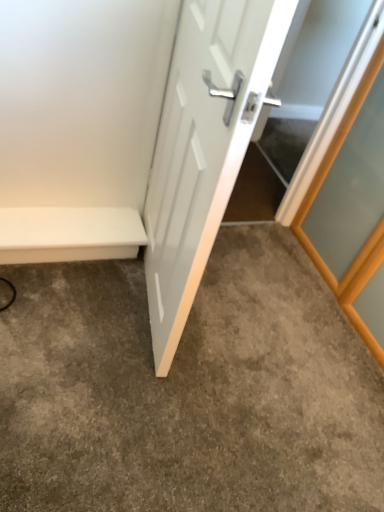
Locate an element on the screen. This screenshot has width=384, height=512. free space in front of white glossy door at center is located at coordinates (119, 391).